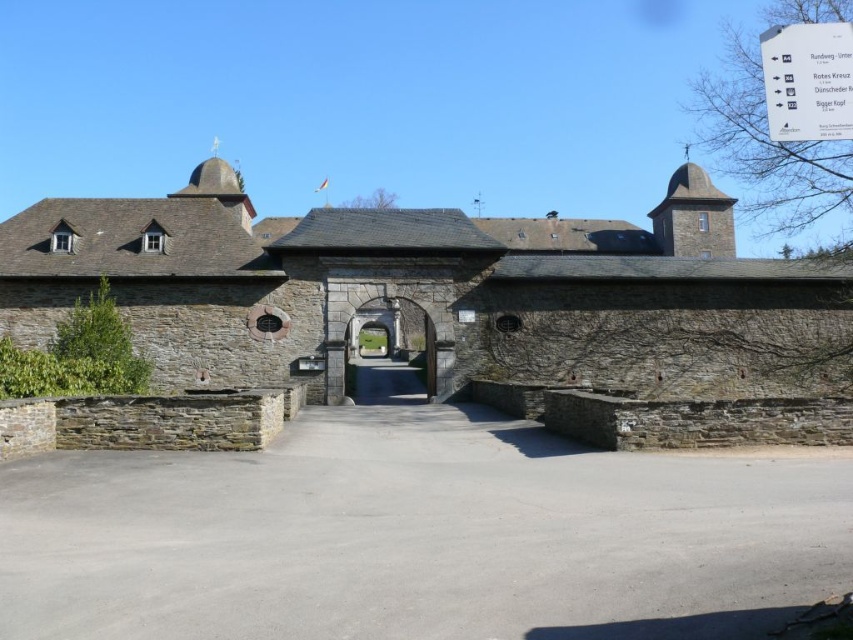
Is gray concrete driveway at center positioned in front of stone archway at center?

That is True.

Who is more forward, [822,472] or [422,364]?

Point [822,472] is in front.

Where is `gray concrete driveway at center`? The image size is (853, 640). gray concrete driveway at center is located at coordinates (419, 532).